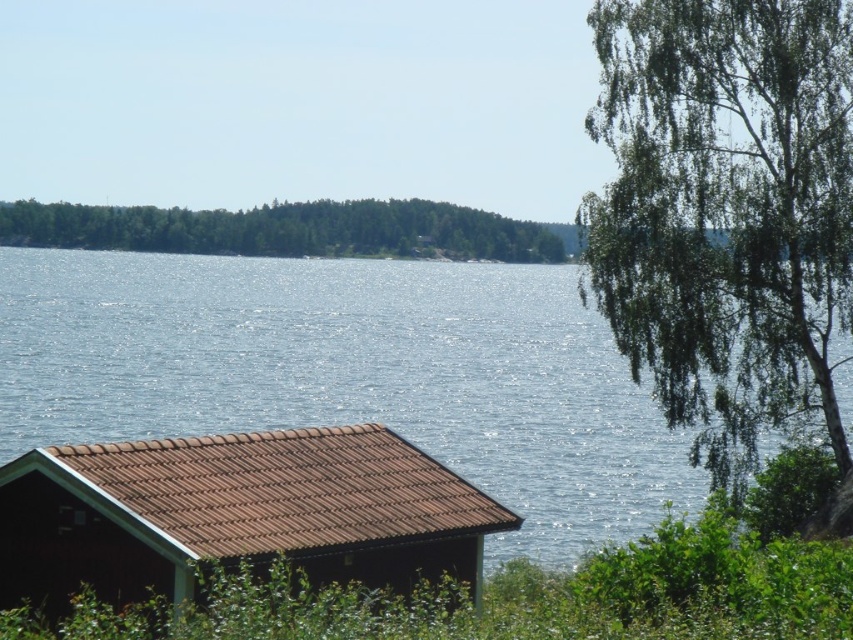
Does glistening blue water at center have a lesser height compared to green leafy forest at upper left?

No.

Between glistening blue water at center and green leafy forest at upper left, which one is positioned higher?

green leafy forest at upper left is above.

Is point (183, 330) positioned before point (247, 218)?

Yes.

At what (x,y) coordinates should I click in order to perform the action: click on glistening blue water at center. Please return your answer as a coordinate pair (x, y). This screenshot has height=640, width=853. Looking at the image, I should click on (350, 372).

Is point (335, 260) in front of point (607, 36)?

That is False.

Is point (500, 339) less distant than point (796, 316)?

No, (500, 339) is behind (796, 316).

Image resolution: width=853 pixels, height=640 pixels. In order to click on glistening blue water at center in this screenshot , I will do `click(350, 372)`.

Between green leafy tree at upper right and green leafy forest at upper left, which one is positioned higher?

Positioned higher is green leafy forest at upper left.

Does green leafy tree at upper right appear under green leafy forest at upper left?

Yes.

Which is behind, point (680, 394) or point (468, 234)?

The point (468, 234) is more distant.

The height and width of the screenshot is (640, 853). Identify the location of green leafy tree at upper right. (726, 212).